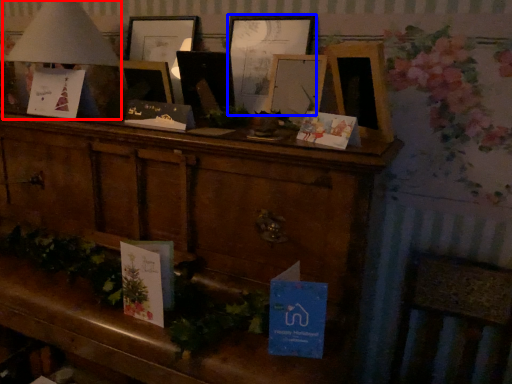
Question: Which object is further to the camera taking this photo, table lamp (highlighted by a red box) or picture frame (highlighted by a blue box)?

Choices:
 (A) table lamp
 (B) picture frame

Answer: (B)